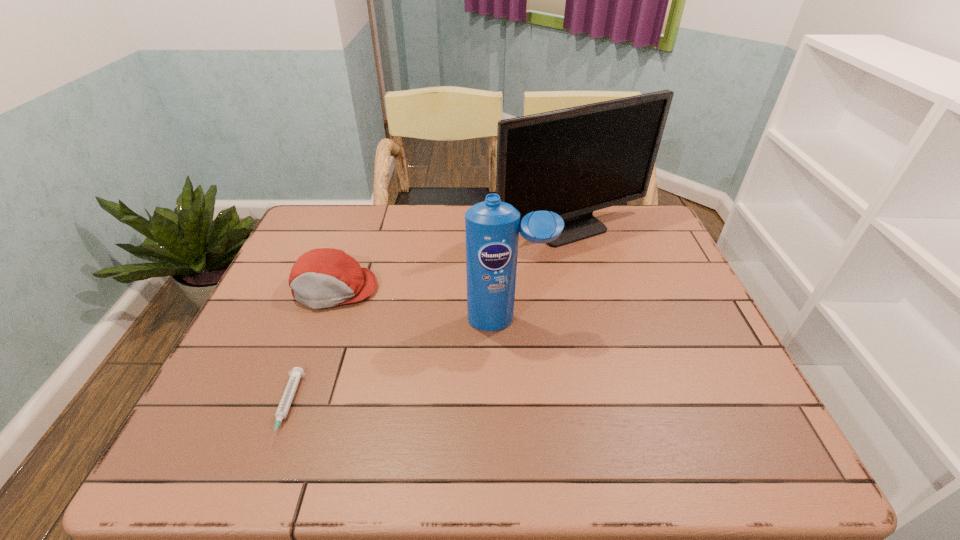
Where is `free space that is in between the shampoo and the farthest object`? The height and width of the screenshot is (540, 960). free space that is in between the shampoo and the farthest object is located at coordinates (540, 276).

This screenshot has height=540, width=960. What are the coordinates of `vacant point located between the shampoo and the syringe` in the screenshot? It's located at (397, 364).

The height and width of the screenshot is (540, 960). What are the coordinates of `free space that is in between the nearest object and the cap` in the screenshot? It's located at (311, 348).

Find the location of a particular element. The width and height of the screenshot is (960, 540). blank region between the second shortest object and the shampoo is located at coordinates (421, 305).

Identify the location of vacant area that lies between the shampoo and the farthest object. (540, 276).

Identify the location of free space between the farthest object and the syringe. The height and width of the screenshot is (540, 960). (429, 320).

Find the location of a particular element. Image resolution: width=960 pixels, height=540 pixels. free space that is in between the cap and the shampoo is located at coordinates (421, 305).

Find the location of `empty space that is in between the shampoo and the shortest object`. empty space that is in between the shampoo and the shortest object is located at coordinates (397, 364).

You are a GUI agent. You are given a task and a screenshot of the screen. Output one action in this format:
    pyautogui.click(x=<x>, y=<y>)
    Task: Click on the free space that is in between the third tallest object and the nearest object
    
    Given the screenshot: What is the action you would take?
    pyautogui.click(x=311, y=348)

You are a GUI agent. You are given a task and a screenshot of the screen. Output one action in this format:
    pyautogui.click(x=<x>, y=<y>)
    Task: Click on the free space between the cap and the computer monitor
    This screenshot has height=540, width=960.
    Given the screenshot: What is the action you would take?
    pyautogui.click(x=454, y=260)